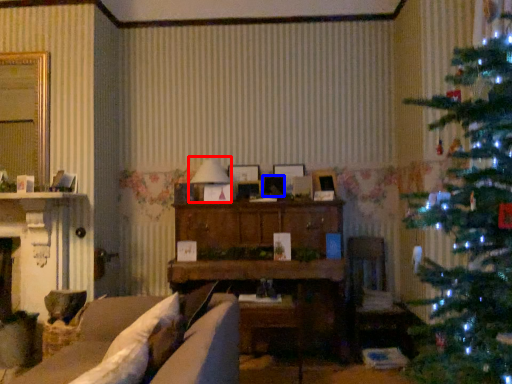
Question: Which point is further to the camera, lamp (highlighted by a red box) or picture frame (highlighted by a blue box)?

Choices:
 (A) lamp
 (B) picture frame

Answer: (B)